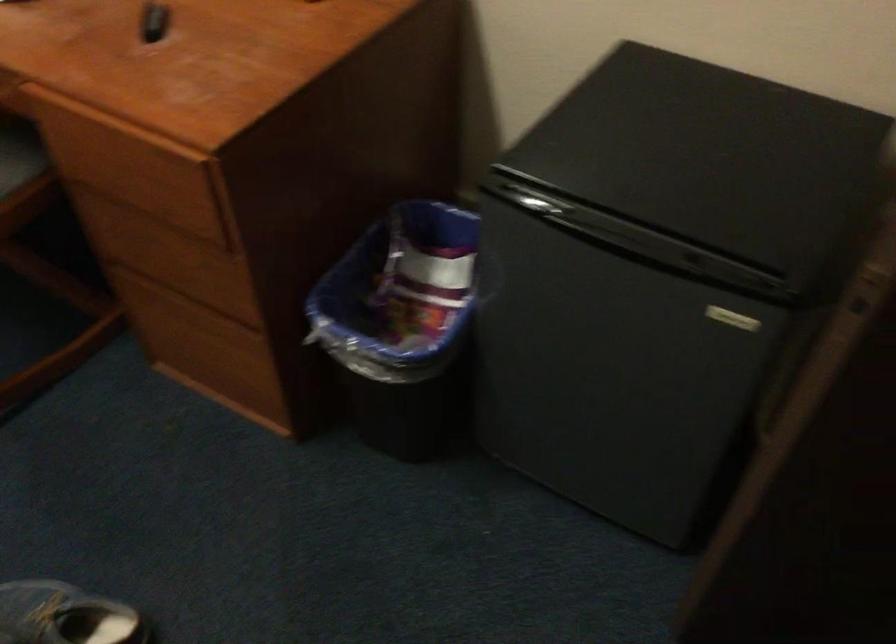
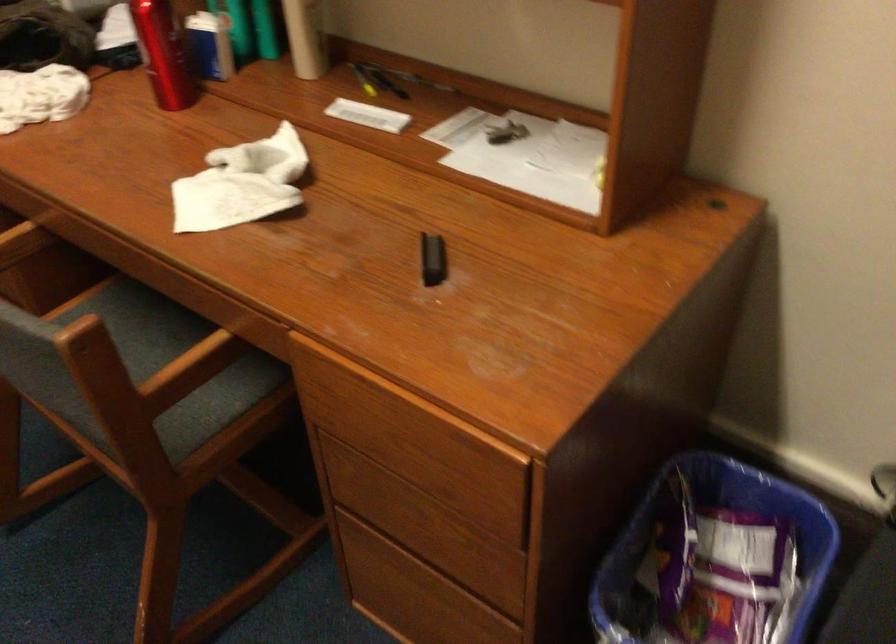
Question: Based on the continuous images, in which direction is the camera rotating? Reply with the corresponding letter.

Choices:
 (A) Left
 (B) Right
 (C) Up
 (D) Down

Answer: (C)